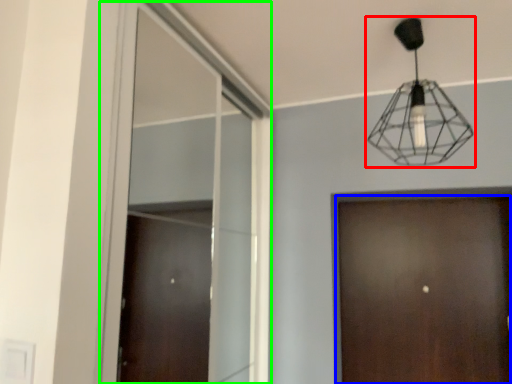
Question: Which object is the farthest from lamp (highlighted by a red box)? Choose among these: door (highlighted by a blue box) or window (highlighted by a green box).

Choices:
 (A) door
 (B) window

Answer: (B)